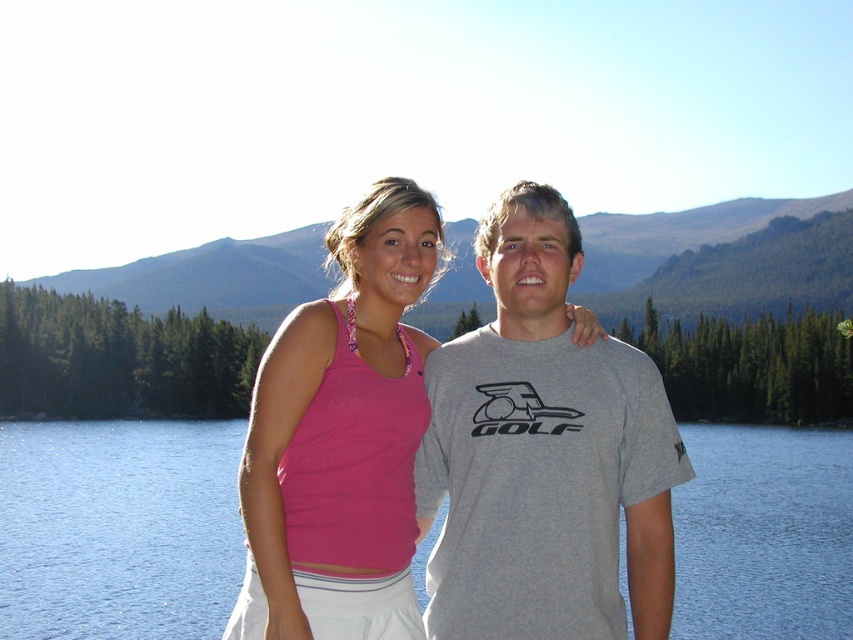
Based on the photo, can you confirm if gray cotton t-shirt at center is shorter than green forested mountain at upper center?

Yes, gray cotton t-shirt at center is shorter than green forested mountain at upper center.

Is point (605, 564) more distant than point (241, 316)?

No, (605, 564) is closer to viewer.

Is point (527, 513) more distant than point (630, 253)?

No, it is not.

The height and width of the screenshot is (640, 853). Find the location of `gray cotton t-shirt at center`. gray cotton t-shirt at center is located at coordinates (544, 456).

Does blue water at center have a lesser width compared to pink fabric tank top at center?

In fact, blue water at center might be wider than pink fabric tank top at center.

Is point (726, 595) positioned behind point (288, 547)?

Yes, it is.

Which is in front, point (111, 560) or point (294, 348)?

Point (294, 348)

This screenshot has height=640, width=853. Find the location of `blue water at center`. blue water at center is located at coordinates (119, 529).

Can you confirm if gray cotton t-shirt at center is positioned above pink fabric tank top at center?

Yes.

Between point (474, 369) and point (379, 410), which one is positioned in front?

Point (379, 410) is more forward.

Describe the element at coordinates (544, 456) in the screenshot. The image size is (853, 640). I see `gray cotton t-shirt at center` at that location.

The width and height of the screenshot is (853, 640). Identify the location of gray cotton t-shirt at center. (544, 456).